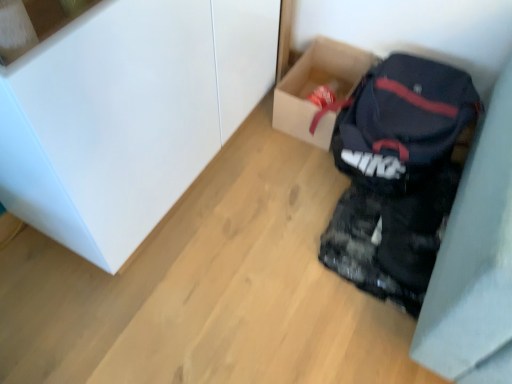
Question: Is matte black backpack at lower right positioned far away from cardboard box at center?

Choices:
 (A) no
 (B) yes

Answer: (A)

Question: Is matte black backpack at lower right to the left of cardboard box at center from the viewer's perspective?

Choices:
 (A) no
 (B) yes

Answer: (A)

Question: Is cardboard box at center surrounded by matte black backpack at lower right?

Choices:
 (A) yes
 (B) no

Answer: (B)

Question: Is matte black backpack at lower right wider than cardboard box at center?

Choices:
 (A) no
 (B) yes

Answer: (B)

Question: From a real-world perspective, does matte black backpack at lower right sit lower than cardboard box at center?

Choices:
 (A) no
 (B) yes

Answer: (A)

Question: From a real-world perspective, is cardboard box at center positioned above or below matte black backpack at lower right?

Choices:
 (A) above
 (B) below

Answer: (B)

Question: Is cardboard box at center taller or shorter than matte black backpack at lower right?

Choices:
 (A) tall
 (B) short

Answer: (B)

Question: Considering the positions of point (333, 77) and point (346, 150), is point (333, 77) closer or farther from the camera than point (346, 150)?

Choices:
 (A) closer
 (B) farther

Answer: (B)

Question: From the image's perspective, is cardboard box at center located above or below matte black backpack at lower right?

Choices:
 (A) above
 (B) below

Answer: (A)

Question: From a real-world perspective, is cardboard box at center above or below white glossy cabinet at upper left?

Choices:
 (A) below
 (B) above

Answer: (A)

Question: Considering the positions of point (309, 76) and point (108, 269), is point (309, 76) closer or farther from the camera than point (108, 269)?

Choices:
 (A) closer
 (B) farther

Answer: (B)

Question: Choose the correct answer: Is cardboard box at center inside white glossy cabinet at upper left or outside it?

Choices:
 (A) outside
 (B) inside

Answer: (A)

Question: In the image, is cardboard box at center positioned in front of or behind white glossy cabinet at upper left?

Choices:
 (A) front
 (B) behind

Answer: (B)

Question: Is white glossy cabinet at upper left wider or thinner than matte black backpack at lower right?

Choices:
 (A) wide
 (B) thin

Answer: (B)

Question: In terms of size, does white glossy cabinet at upper left appear bigger or smaller than matte black backpack at lower right?

Choices:
 (A) small
 (B) big

Answer: (B)